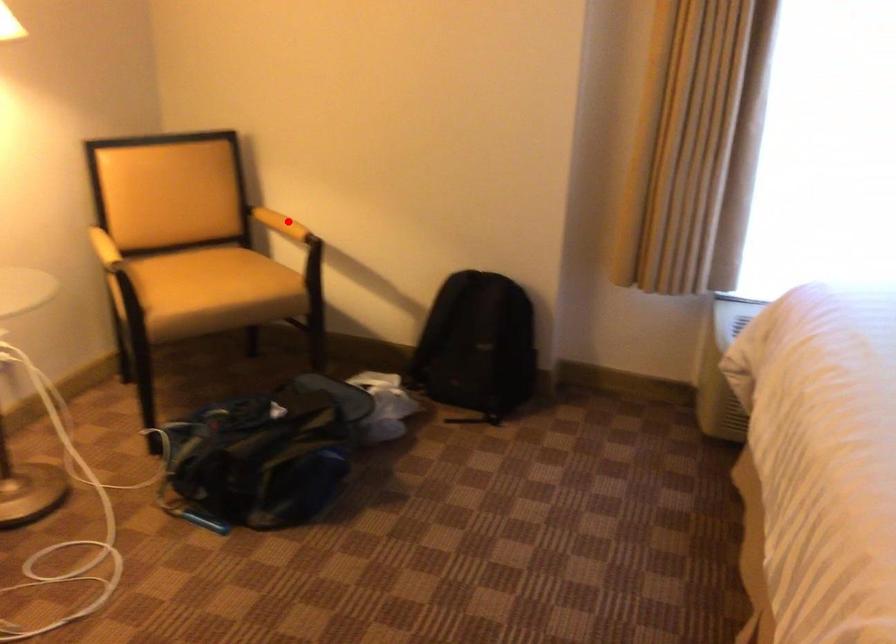
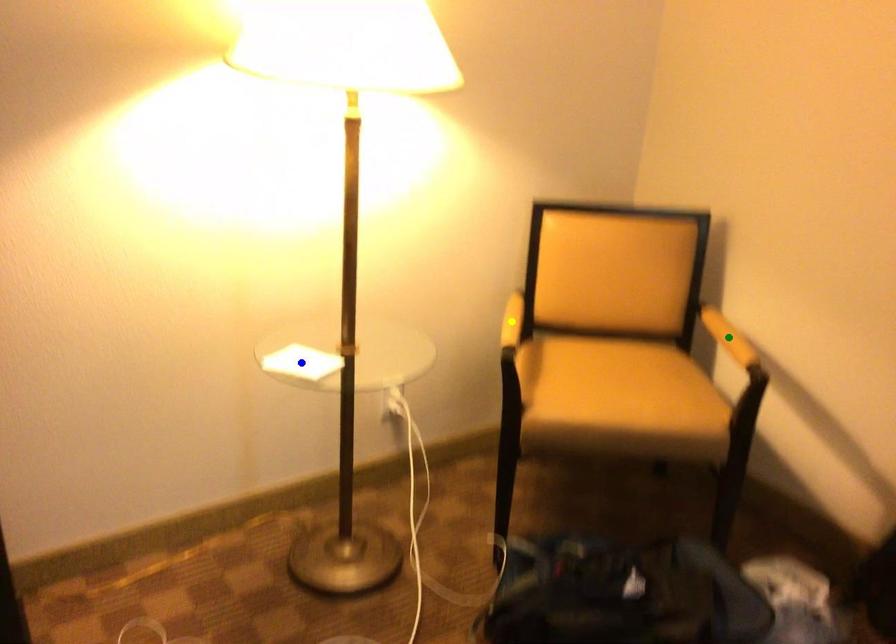
Question: I am providing you with two images of the same scene from different viewpoints. A red point is marked on the first image. You are given multiple points on the second image. In image 2, which mark is for the same physical point as the one in image 1?

Choices:
 (A) green point
 (B) blue point
 (C) yellow point

Answer: (A)